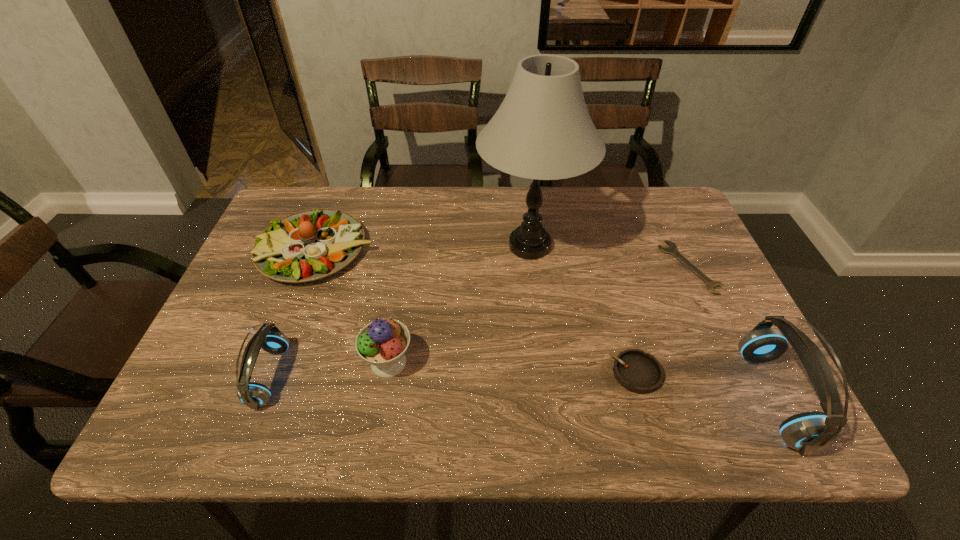
Locate an element on the screen. free space located on the front of the shortest object is located at coordinates (720, 332).

Find the location of `vacant space situated on the right of the salad plate`. vacant space situated on the right of the salad plate is located at coordinates (396, 249).

At what (x,y) coordinates should I click in order to perform the action: click on free region located 0.190m on the right of the fifth object from right to left. Please return your answer as a coordinate pair (x, y). Looking at the image, I should click on (501, 362).

At what (x,y) coordinates should I click in order to perform the action: click on vacant space located on the back of the ashtray. Please return your answer as a coordinate pair (x, y). The height and width of the screenshot is (540, 960). Looking at the image, I should click on (608, 276).

The width and height of the screenshot is (960, 540). Find the location of `lamp located at the far edge`. lamp located at the far edge is located at coordinates (542, 130).

Identify the location of salad plate that is positioned at the far edge. (312, 244).

You are a GUI agent. You are given a task and a screenshot of the screen. Output one action in this format:
    pyautogui.click(x=<x>, y=<y>)
    Task: Click on the icecream located at the near edge
    
    Given the screenshot: What is the action you would take?
    pyautogui.click(x=382, y=343)

The height and width of the screenshot is (540, 960). I want to click on ashtray that is at the near edge, so click(639, 372).

In order to click on headset that is at the left edge in this screenshot , I will do `click(252, 394)`.

The image size is (960, 540). I want to click on salad plate situated at the left edge, so (x=312, y=244).